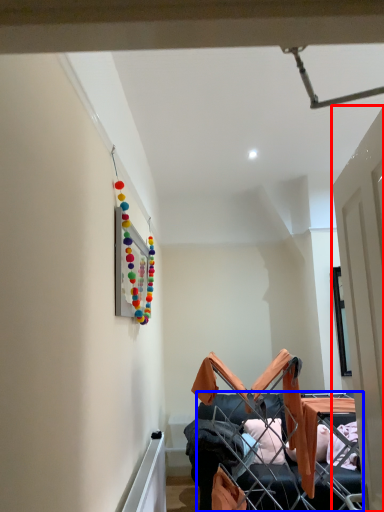
Question: Which object is further to the camera taking this photo, door (highlighted by a red box) or furniture (highlighted by a blue box)?

Choices:
 (A) door
 (B) furniture

Answer: (B)